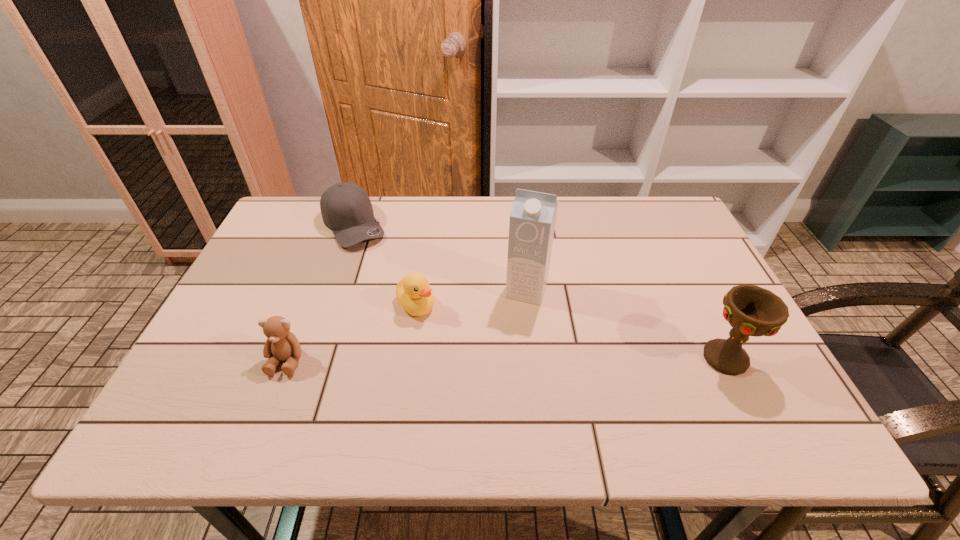
Identify the location of vacant area between the rightmost object and the duckling. (570, 331).

Identify the location of blank region between the farthest object and the teddy bear. Image resolution: width=960 pixels, height=540 pixels. (321, 293).

Find the location of `free space between the tallest object and the second tallest object`. free space between the tallest object and the second tallest object is located at coordinates (626, 324).

Where is `free space between the duckling and the teddy bear`? free space between the duckling and the teddy bear is located at coordinates (351, 332).

Where is `empty space between the fourth shortest object and the third object from left to right`? This screenshot has width=960, height=540. empty space between the fourth shortest object and the third object from left to right is located at coordinates (570, 331).

Find the location of a particular element. Image resolution: width=960 pixels, height=540 pixels. unoccupied area between the third object from right to left and the teddy bear is located at coordinates (351, 332).

This screenshot has height=540, width=960. What are the coordinates of `vacant region between the farthest object and the teddy bear` in the screenshot? It's located at (321, 293).

Locate an element on the screen. This screenshot has height=540, width=960. free space that is in between the chalice and the second object from right to left is located at coordinates (626, 324).

The height and width of the screenshot is (540, 960). Find the location of `free point between the teddy bear and the fourth shortest object`. free point between the teddy bear and the fourth shortest object is located at coordinates (506, 359).

At what (x,y) coordinates should I click in order to perform the action: click on object that is the third closest to the tallest object. Please return your answer as a coordinate pair (x, y). Looking at the image, I should click on (346, 209).